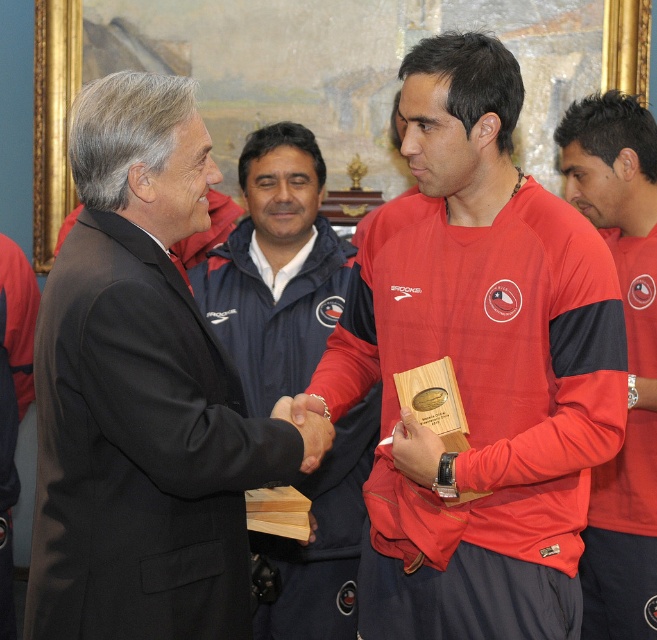
You are a photographer standing at the back of the room. You want to take a photo of both the red matte jacket at center and the red matte jersey at center in the same frame. What is the minimum distance you need to move back to ensure both objects are fully visible?

The red matte jacket at center is 2.00 meters from the red matte jersey at center. To capture both in the same frame, you need to move back at least 2.00 meters to ensure both are fully visible.